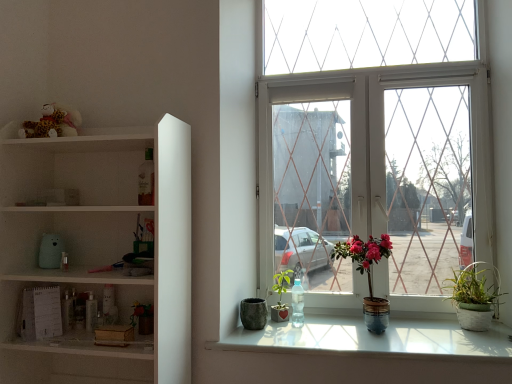
Locate an element on the screen. Image resolution: width=512 pixels, height=384 pixels. free region under white woven basket at lower right, placed as the first houseplant when sorted from right to left (from a real-world perspective) is located at coordinates (475, 327).